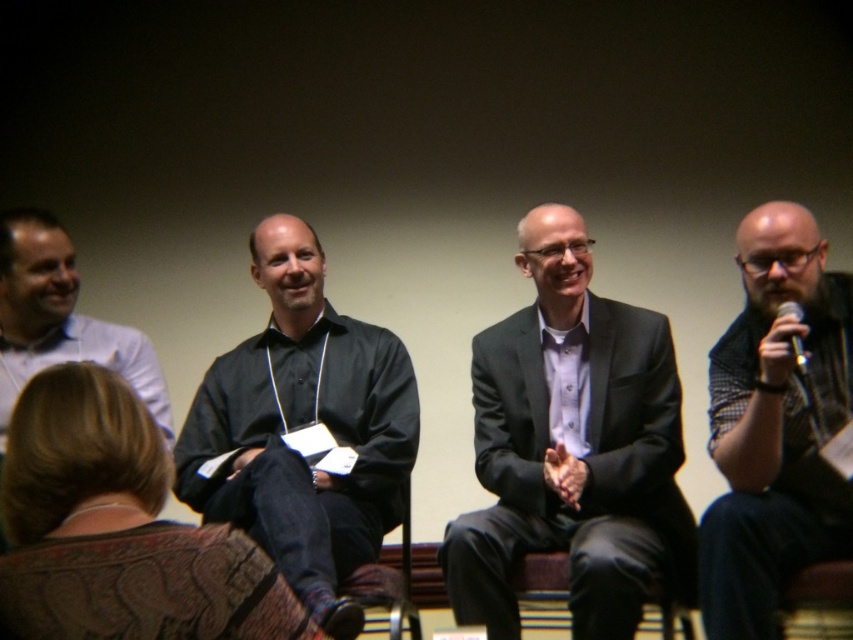
Question: Does black matte shirt at center have a lesser width compared to metallic silver microphone at right?

Choices:
 (A) no
 (B) yes

Answer: (A)

Question: Based on their relative distances, which object is nearer to the metallic silver microphone at right?

Choices:
 (A) black textured shirt at right
 (B) black matte shirt at center
 (C) white shirt at left

Answer: (A)

Question: Is dark gray suit at center closer to camera compared to metallic silver microphone at right?

Choices:
 (A) yes
 (B) no

Answer: (B)

Question: Which point is closer to the camera?

Choices:
 (A) black matte shirt at center
 (B) metallic silver microphone at right
 (C) white shirt at left
 (D) dark gray suit at center

Answer: (A)

Question: Which object is closer to the camera taking this photo?

Choices:
 (A) white shirt at left
 (B) metallic silver microphone at right
 (C) black matte shirt at center

Answer: (C)

Question: Is black matte shirt at center positioned before black textured shirt at right?

Choices:
 (A) yes
 (B) no

Answer: (A)